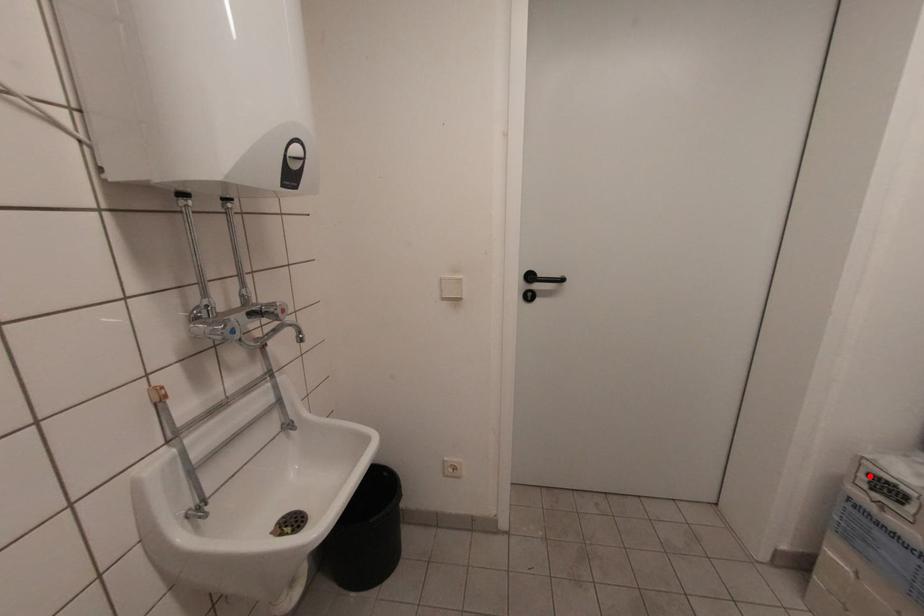
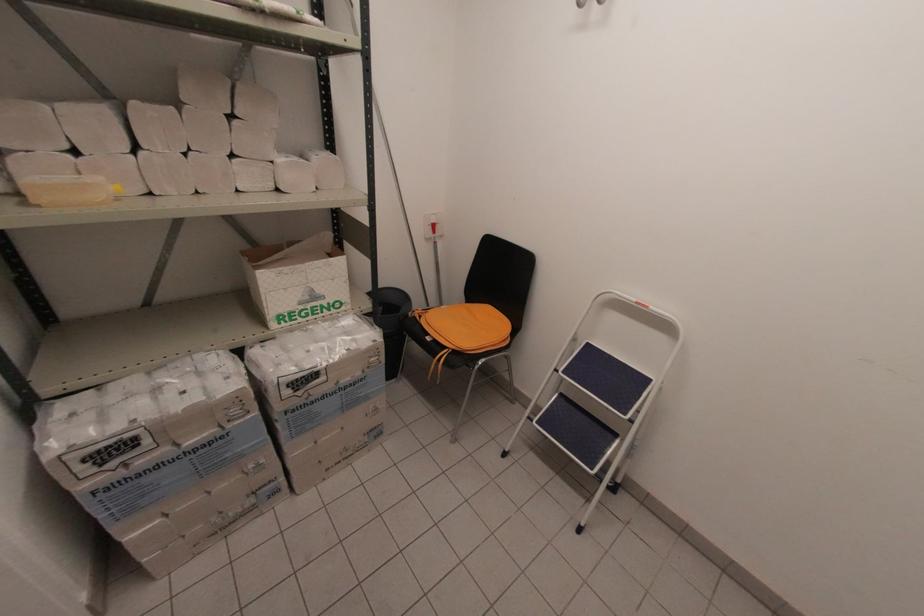
Where in the second image is the point corresponding to the highlighted location from the first image?

(84, 463)